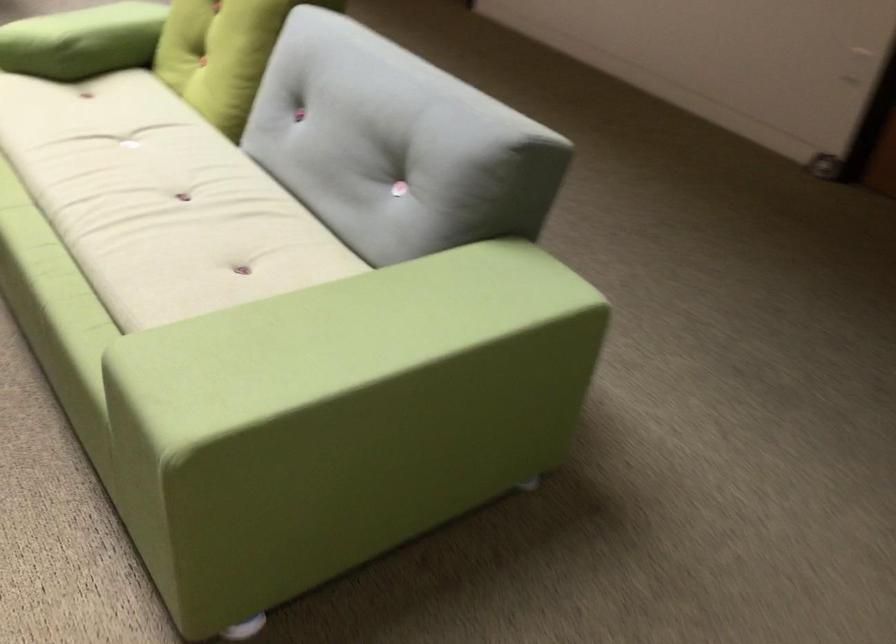
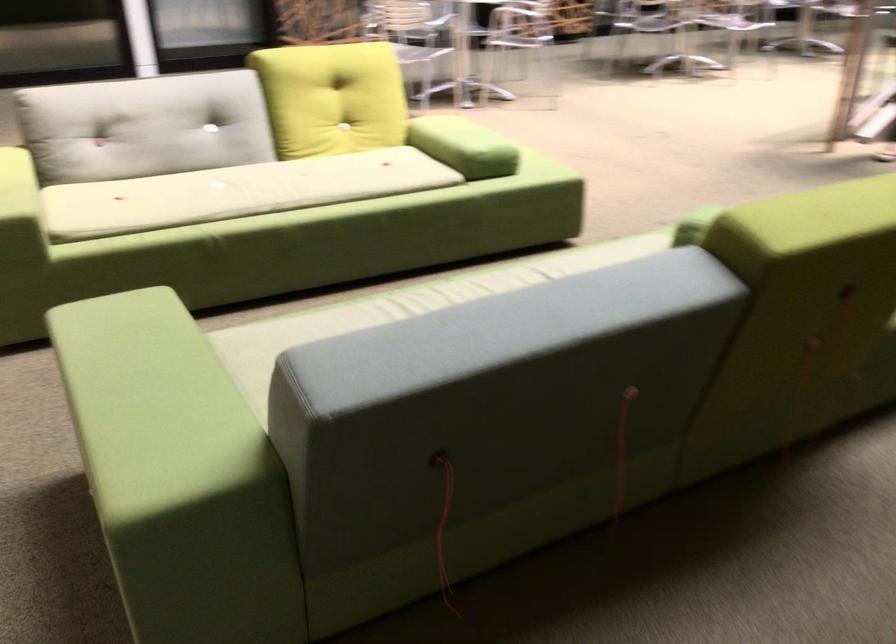
In the second image, find the point that corresponds to point (466, 297) in the first image.

(151, 404)